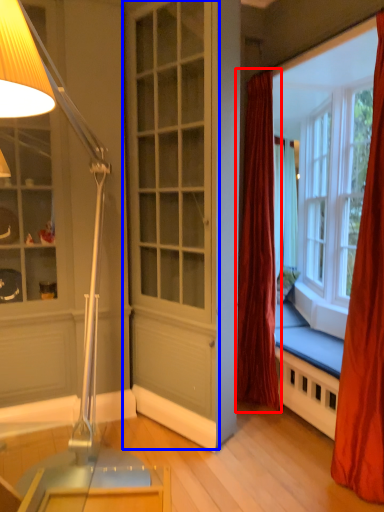
Question: Which of the following is the farthest to the observer, curtain (highlighted by a red box) or screen door (highlighted by a blue box)?

Choices:
 (A) curtain
 (B) screen door

Answer: (A)